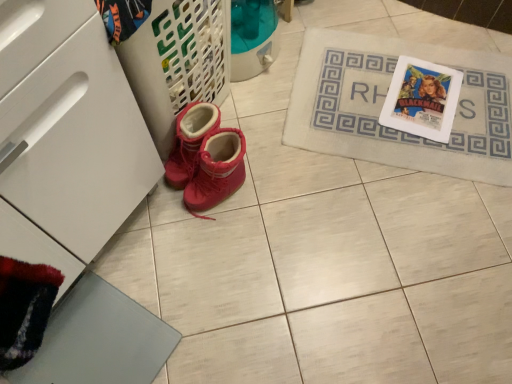
Question: From a real-world perspective, is suede-like red boots at lower left on white matte drawer at lower left?

Choices:
 (A) no
 (B) yes

Answer: (A)

Question: Does suede-like red boots at lower left have a lesser height compared to white matte drawer at lower left?

Choices:
 (A) no
 (B) yes

Answer: (B)

Question: Does suede-like red boots at lower left appear on the left side of white matte drawer at lower left?

Choices:
 (A) yes
 (B) no

Answer: (B)

Question: From the image's perspective, would you say suede-like red boots at lower left is shown under white matte drawer at lower left?

Choices:
 (A) no
 (B) yes

Answer: (A)

Question: From the image's perspective, is suede-like red boots at lower left on white matte drawer at lower left?

Choices:
 (A) yes
 (B) no

Answer: (A)

Question: Would you say white matte drawer at lower left is part of suede-like red boots at lower left's contents?

Choices:
 (A) no
 (B) yes

Answer: (A)

Question: Can you confirm if beige fabric bath mat at upper right is thinner than suede-like red boots at lower left?

Choices:
 (A) yes
 (B) no

Answer: (B)

Question: Considering the relative positions of beige fabric bath mat at upper right and suede-like red boots at lower left in the image provided, is beige fabric bath mat at upper right in front of suede-like red boots at lower left?

Choices:
 (A) yes
 (B) no

Answer: (B)

Question: Is beige fabric bath mat at upper right not inside suede-like red boots at lower left?

Choices:
 (A) yes
 (B) no

Answer: (A)

Question: From the image's perspective, does beige fabric bath mat at upper right appear lower than suede-like red boots at lower left?

Choices:
 (A) yes
 (B) no

Answer: (B)

Question: Considering the relative sizes of beige fabric bath mat at upper right and suede-like red boots at lower left in the image provided, is beige fabric bath mat at upper right bigger than suede-like red boots at lower left?

Choices:
 (A) yes
 (B) no

Answer: (A)

Question: Does beige fabric bath mat at upper right appear on the right side of suede-like red boots at lower left?

Choices:
 (A) yes
 (B) no

Answer: (A)

Question: From the image's perspective, does white matte drawer at lower left appear lower than beige fabric bath mat at upper right?

Choices:
 (A) no
 (B) yes

Answer: (B)